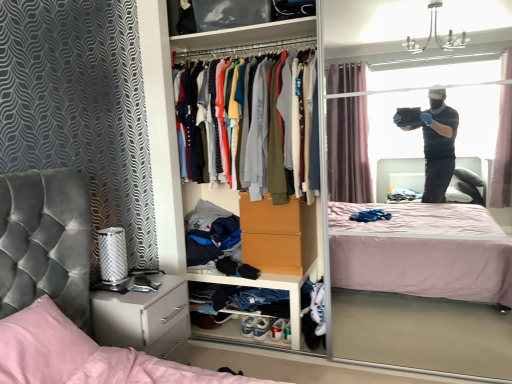
Question: Would you say white leather sneakers at lower center, marked as the first footwear in a right-to-left arrangement, is inside or outside white leather sneakers at lower center, arranged as the 1th footwear when viewed from the left?

Choices:
 (A) outside
 (B) inside

Answer: (A)

Question: Looking at their shapes, would you say white leather sneakers at lower center, marked as the first footwear in a right-to-left arrangement, is wider or thinner than white leather sneakers at lower center, positioned as the 2th footwear in right-to-left order?

Choices:
 (A) wide
 (B) thin

Answer: (A)

Question: Estimate the real-world distances between objects in this image. Which object is farther from the pink satin pillow at lower left?

Choices:
 (A) white matte cabinet at lower center
 (B) soft cotton shirts at center
 (C) white leather sneakers at lower center, marked as the first footwear in a right-to-left arrangement
 (D) pink quilted bed at center
 (E) white glossy nightstand at lower left

Answer: (C)

Question: Estimate the real-world distances between objects in this image. Which object is farther from the pink quilted bed at center?

Choices:
 (A) white leather sneakers at lower center, positioned as the 2th footwear in right-to-left order
 (B) white matte cabinet at lower center
 (C) white leather sneakers at lower center, placed as the second footwear when sorted from left to right
 (D) soft cotton shirts at center
 (E) white glossy nightstand at lower left

Answer: (A)